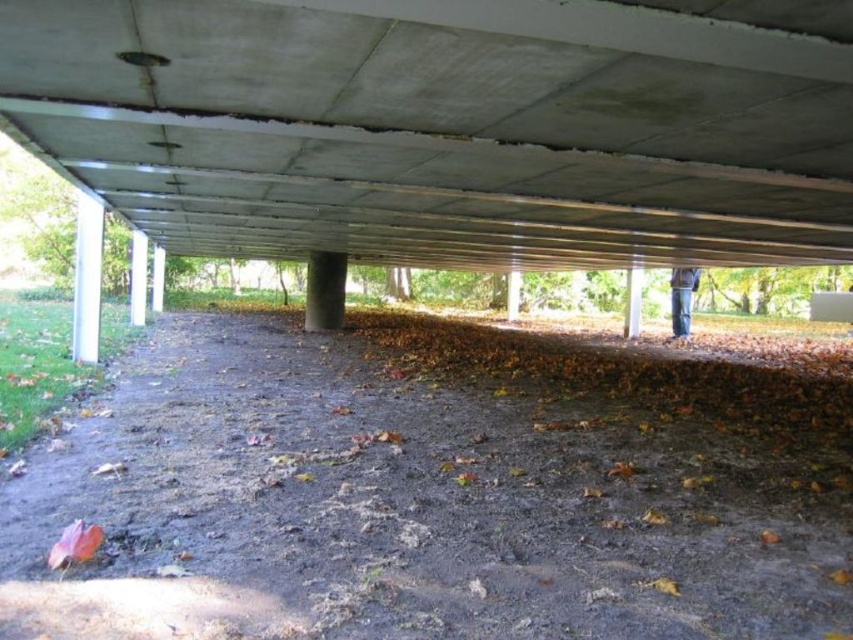
Question: Which object is farther from the camera taking this photo?

Choices:
 (A) concrete ceiling at center
 (B) dirt ground at center

Answer: (A)

Question: Considering the relative positions of concrete ceiling at center and dirt ground at center in the image provided, where is concrete ceiling at center located with respect to dirt ground at center?

Choices:
 (A) above
 (B) below

Answer: (A)

Question: Is concrete ceiling at center thinner than dirt ground at center?

Choices:
 (A) no
 (B) yes

Answer: (B)

Question: Is concrete ceiling at center bigger than dirt ground at center?

Choices:
 (A) no
 (B) yes

Answer: (A)